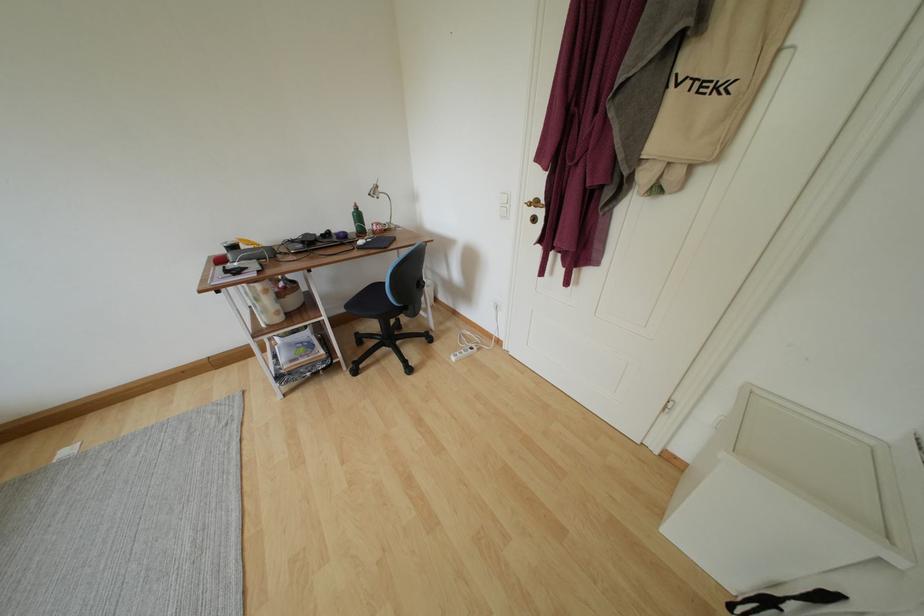
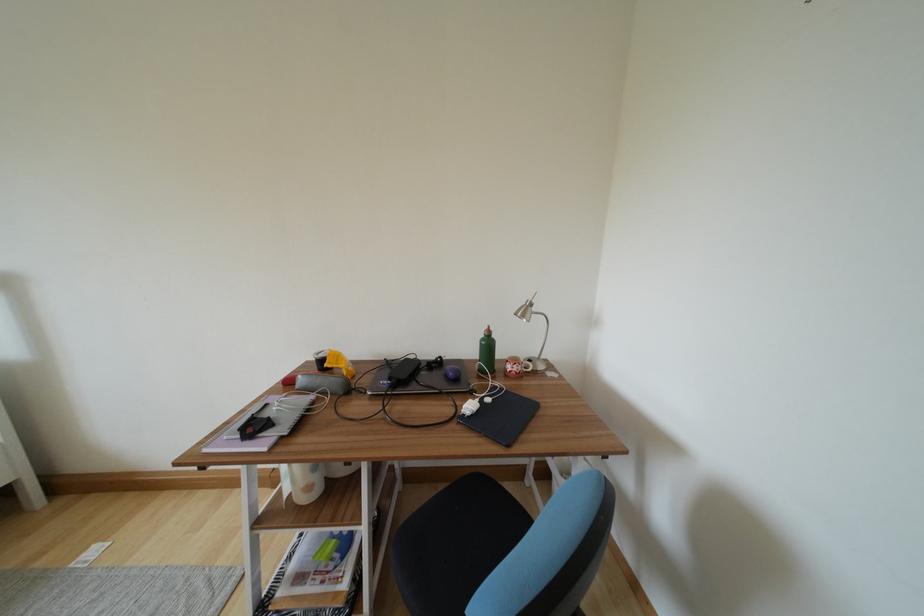
Find the pixel in the second image that matches point 308,246 in the first image.

(395, 382)